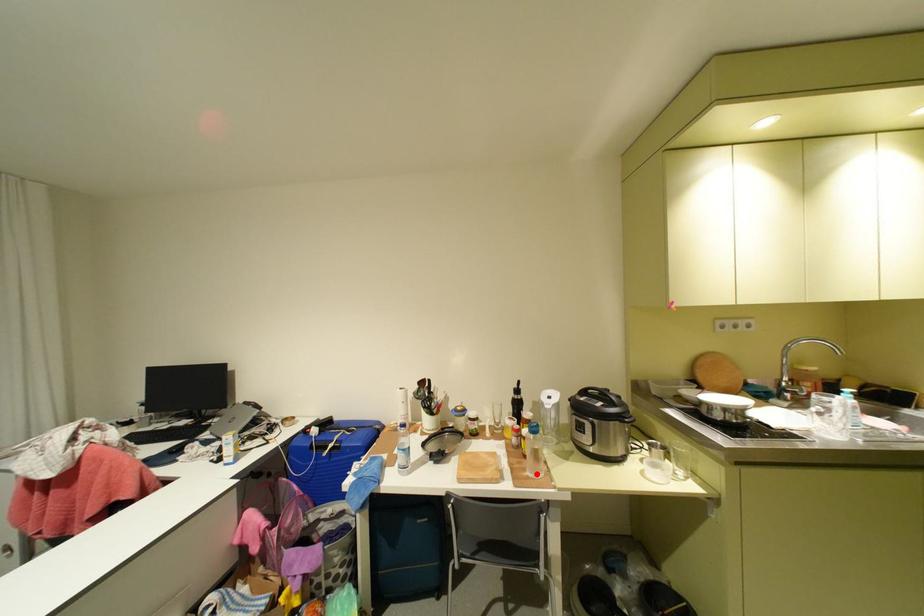
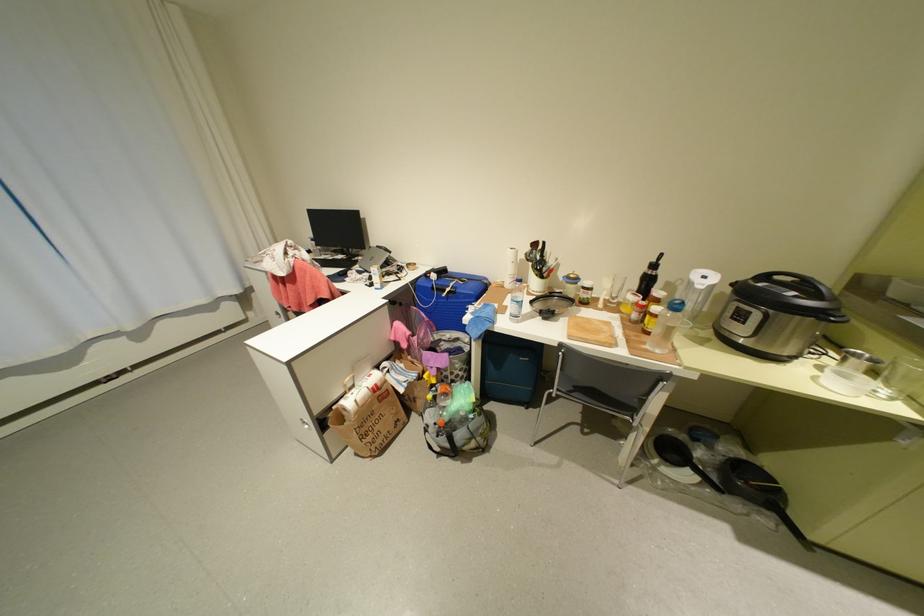
Find the pixel in the second image that matches the highlighted location in the first image.

(655, 347)